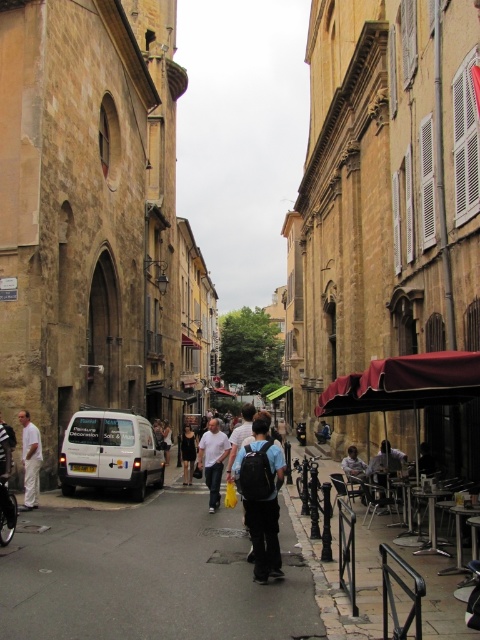
Question: Can you confirm if white cotton pants at lower left is positioned below dark blue jeans at center?

Choices:
 (A) no
 (B) yes

Answer: (B)

Question: Is matte black backpack at center closer to camera compared to dark blue jeans at center?

Choices:
 (A) yes
 (B) no

Answer: (A)

Question: Which of these objects is positioned farthest from the metallic silver table at lower right?

Choices:
 (A) dark blue jeans at center
 (B) white cotton pants at lower left

Answer: (B)

Question: Which object appears closest to the camera in this image?

Choices:
 (A) black dress at center
 (B) dark blue jeans at center
 (C) white cotton pants at lower left
 (D) white cotton shirt at center

Answer: (B)

Question: Can you confirm if gray asphalt pavement at center is positioned to the left of white matte van at center?

Choices:
 (A) no
 (B) yes

Answer: (A)

Question: Which of these objects is positioned closest to the matte black backpack at center?

Choices:
 (A) white matte van at center
 (B) black dress at center

Answer: (A)